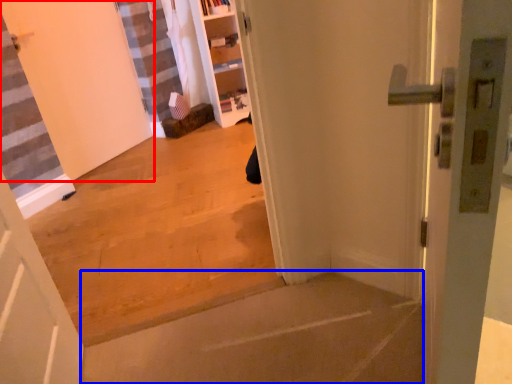
Question: Which of the following is the farthest to the observer, door (highlighted by a red box) or concrete (highlighted by a blue box)?

Choices:
 (A) door
 (B) concrete

Answer: (A)